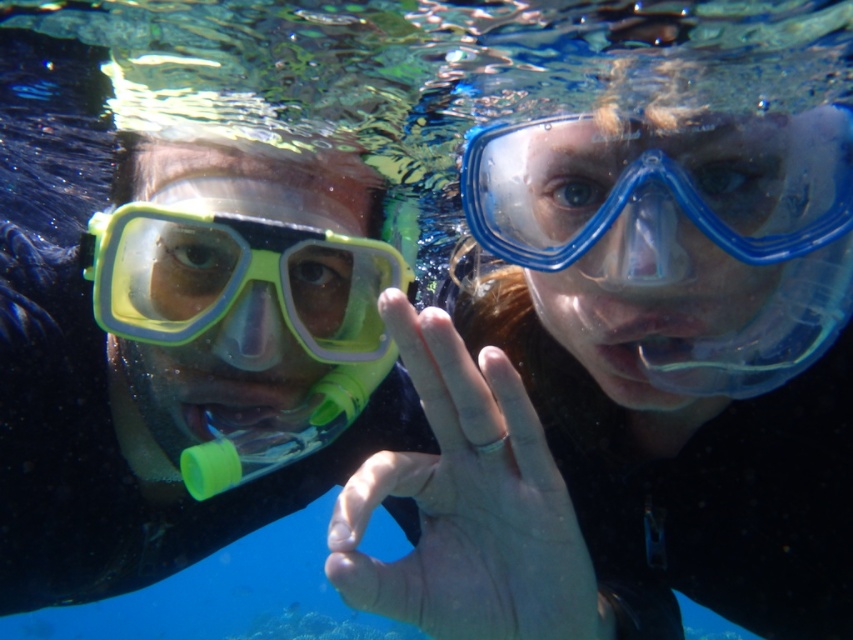
Question: Which point is farther to the camera?

Choices:
 (A) (456, 634)
 (B) (842, 116)
 (C) (142, 273)
 (D) (10, 596)

Answer: (D)

Question: Does matte green snorkel mask at left appear on the left side of yellow-green plastic goggles at left?

Choices:
 (A) yes
 (B) no

Answer: (A)

Question: Which object appears closest to the camera in this image?

Choices:
 (A) transparent blue goggles at upper right
 (B) clear skin hand at center
 (C) yellow-green plastic goggles at left

Answer: (B)

Question: Which point is closer to the camera taking this photo?

Choices:
 (A) (373, 294)
 (B) (625, 163)
 (C) (473, 403)
 (D) (292, 182)

Answer: (C)

Question: Does clear skin hand at center have a larger size compared to transparent blue goggles at upper right?

Choices:
 (A) no
 (B) yes

Answer: (B)

Question: Can you confirm if matte green snorkel mask at left is positioned to the right of transparent blue goggles at upper right?

Choices:
 (A) no
 (B) yes

Answer: (A)